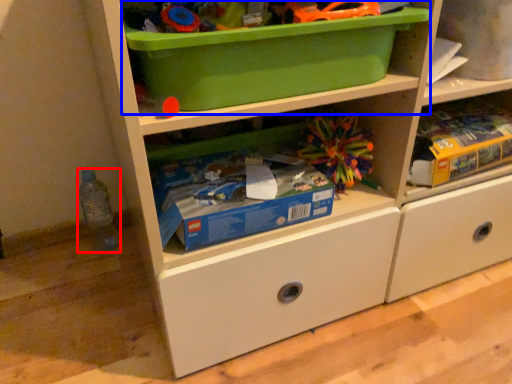
Question: Which object appears farthest to the camera in this image, bottle (highlighted by a red box) or storage box (highlighted by a blue box)?

Choices:
 (A) bottle
 (B) storage box

Answer: (A)